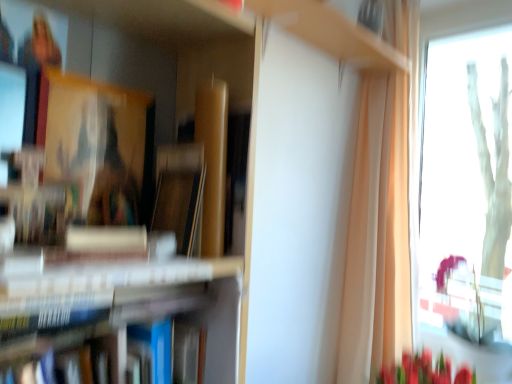
The height and width of the screenshot is (384, 512). Identify the location of hardcover books at left. (128, 305).

Find the location of a particular element. transparent glass window at right is located at coordinates (466, 180).

Measure the distance between point [372,57] and camera.

Point [372,57] is 4.91 feet away from camera.

What is the approximate width of wooden cabinet at upper center?

wooden cabinet at upper center is 9.27 inches in width.

Find the location of a particular element. hardcover books at left is located at coordinates (128, 305).

From a real-world perspective, relative to transparent glass window at right, is hardcover books at left vertically above or below?

Clearly, from a real-world perspective, hardcover books at left is below transparent glass window at right.

Does hardcover books at left come in front of transparent glass window at right?

Yes, the depth of hardcover books at left is less than that of transparent glass window at right.

How many degrees apart are the facing directions of hardcover books at left and transparent glass window at right?

The angle between the facing direction of hardcover books at left and the facing direction of transparent glass window at right is 89.8 degrees.

Considering the positions of objects hardcover books at left and transparent glass window at right in the image provided, who is more to the left, hardcover books at left or transparent glass window at right?

From the viewer's perspective, hardcover books at left appears more on the left side.

Considering the sizes of objects wooden cabinet at upper center and hardcover books at left in the image provided, who is wider, wooden cabinet at upper center or hardcover books at left?

Wider between the two is hardcover books at left.

From the image's perspective, is wooden cabinet at upper center above hardcover books at left?

Yes, from the image's perspective, wooden cabinet at upper center is over hardcover books at left.

From the picture: Considering the relative positions of wooden cabinet at upper center and hardcover books at left in the image provided, is wooden cabinet at upper center to the left or to the right of hardcover books at left?

Clearly, wooden cabinet at upper center is on the right of hardcover books at left in the image.

From a real-world perspective, is hardcover books at left below wooden cabinet at upper center?

Indeed, from a real-world perspective, hardcover books at left is positioned beneath wooden cabinet at upper center.

Between hardcover books at left and wooden cabinet at upper center, which one appears on the left side from the viewer's perspective?

From the viewer's perspective, hardcover books at left appears more on the left side.

How far apart are hardcover books at left and wooden cabinet at upper center?

hardcover books at left and wooden cabinet at upper center are 30.13 inches apart from each other.

This screenshot has width=512, height=384. Identify the location of bookshelf that appears below the wooden cabinet at upper center (from a real-world perspective). (128, 305).

Which point is more forward, [490,153] or [277,11]?

Point [277,11]

Between transparent glass window at right and wooden cabinet at upper center, which one appears on the left side from the viewer's perspective?

Positioned to the left is wooden cabinet at upper center.

Who is bigger, transparent glass window at right or wooden cabinet at upper center?

transparent glass window at right.

Is transparent glass window at right situated inside wooden cabinet at upper center or outside?

transparent glass window at right exists outside the volume of wooden cabinet at upper center.

Is wooden cabinet at upper center oriented away from transparent glass window at right?

That's not correct — wooden cabinet at upper center is not looking away from transparent glass window at right.

Where is `cabinet above the transparent glass window at right (from a real-world perspective)`? Image resolution: width=512 pixels, height=384 pixels. cabinet above the transparent glass window at right (from a real-world perspective) is located at coordinates (332, 33).

Is wooden cabinet at upper center positioned beyond the bounds of transparent glass window at right?

Yes, wooden cabinet at upper center is outside of transparent glass window at right.

Does transparent glass window at right have a larger size compared to hardcover books at left?

Correct, transparent glass window at right is larger in size than hardcover books at left.

Does transparent glass window at right appear on the right side of hardcover books at left?

Indeed, transparent glass window at right is positioned on the right side of hardcover books at left.

Based on the photo, is transparent glass window at right placed right next to hardcover books at left?

transparent glass window at right is not next to hardcover books at left, and they're not touching.

Considering the relative positions of transparent glass window at right and hardcover books at left in the image provided, is transparent glass window at right in front of hardcover books at left?

No, transparent glass window at right is further to the viewer.

At what (x,y) coordinates should I click in order to perform the action: click on window above the hardcover books at left (from a real-world perspective). Please return your answer as a coordinate pair (x, y). Image resolution: width=512 pixels, height=384 pixels. Looking at the image, I should click on (466, 180).

I want to click on bookshelf in front of the wooden cabinet at upper center, so click(128, 305).

Considering their positions, is transparent glass window at right positioned closer to hardcover books at left than wooden cabinet at upper center?

wooden cabinet at upper center.

Considering their positions, is wooden cabinet at upper center positioned closer to transparent glass window at right than hardcover books at left?

Among the two, wooden cabinet at upper center is located nearer to transparent glass window at right.

In the scene shown: Based on their spatial positions, is transparent glass window at right or hardcover books at left further from wooden cabinet at upper center?

transparent glass window at right lies further to wooden cabinet at upper center than the other object.

Based on the photo, considering their positions, is hardcover books at left positioned closer to transparent glass window at right than wooden cabinet at upper center?

wooden cabinet at upper center is positioned closer to the anchor transparent glass window at right.

Looking at this image, estimate the real-world distances between objects in this image. Which object is closer to hardcover books at left, wooden cabinet at upper center or transparent glass window at right?

wooden cabinet at upper center lies closer to hardcover books at left than the other object.

Estimate the real-world distances between objects in this image. Which object is closer to wooden cabinet at upper center, hardcover books at left or transparent glass window at right?

Based on the image, hardcover books at left appears to be nearer to wooden cabinet at upper center.

Image resolution: width=512 pixels, height=384 pixels. What are the coordinates of `cabinet between hardcover books at left and transparent glass window at right` in the screenshot? It's located at (332, 33).